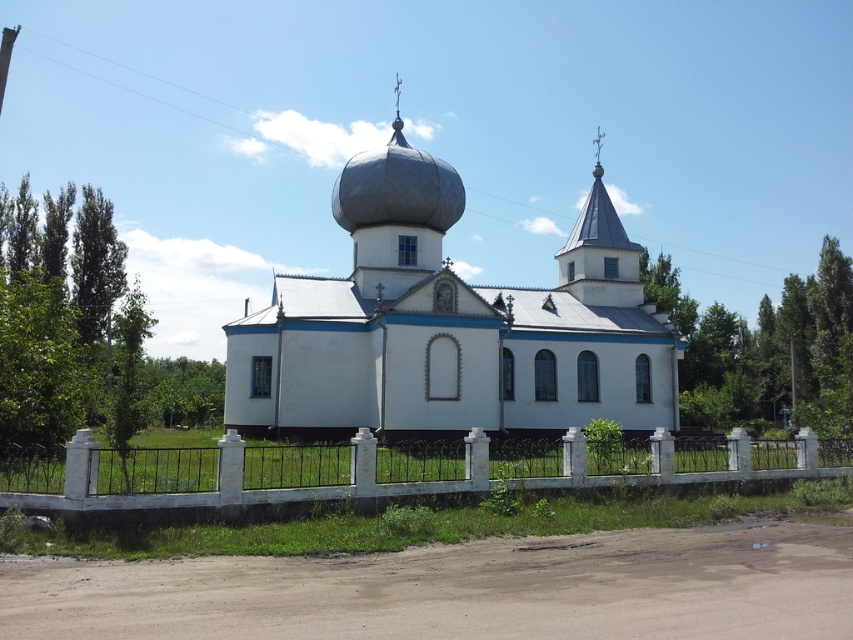
Question: Which point appears farthest from the camera in this image?

Choices:
 (A) 222,512
 (B) 380,161
 (C) 587,200

Answer: (C)

Question: Does white smooth church at center have a larger size compared to white concrete fence at lower center?

Choices:
 (A) yes
 (B) no

Answer: (A)

Question: Which of the following is the closest to the observer?

Choices:
 (A) shiny silver dome at center
 (B) white concrete fence at lower center

Answer: (B)

Question: Which of the following is the closest to the observer?

Choices:
 (A) (399, 195)
 (B) (299, 492)
 (C) (434, 256)

Answer: (B)

Question: Can you confirm if white smooth church at center is bigger than white concrete fence at lower center?

Choices:
 (A) no
 (B) yes

Answer: (B)

Question: Is white smooth church at center in front of shiny silver dome at center?

Choices:
 (A) no
 (B) yes

Answer: (B)